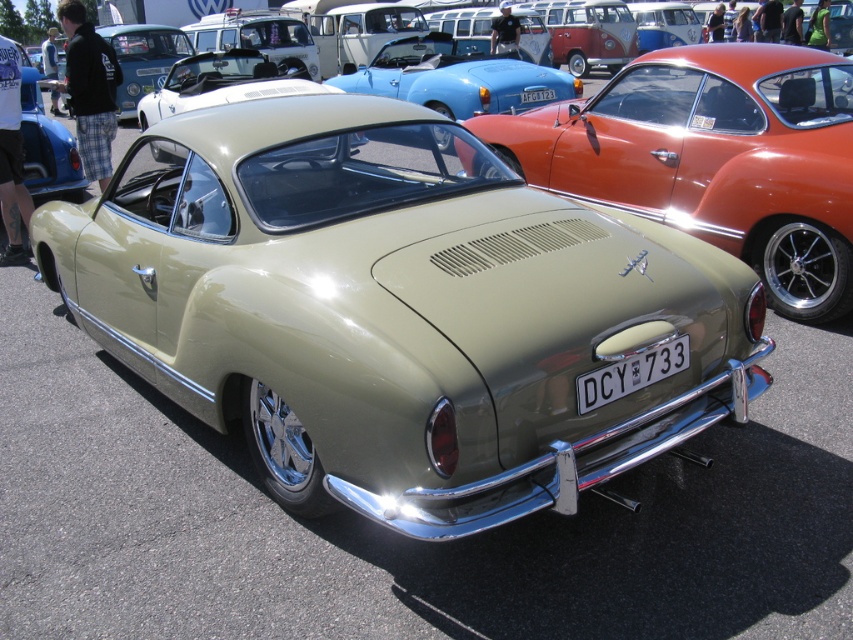
You are a photographer trying to capture the matte green car at center and the white metallic license plate at center in a single shot. Since the camera can only focus on one object at a time, which object should you focus on to ensure it takes up more of the frame?

The matte green car at center is wider than the white metallic license plate at center, so focusing on the matte green car at center will ensure it takes up more of the frame.

You are a photographer trying to capture the Volkswagen Karmann Ghia from the front. You need to focus on the white metallic license plate at center. Where should you aim your camera to ensure the license plate is in the center of the photo?

The white metallic license plate at center is positioned at point 0.584 on the x axis and 0.741 on the y axis, so you should aim your camera at those coordinates to center the license plate in the photo.